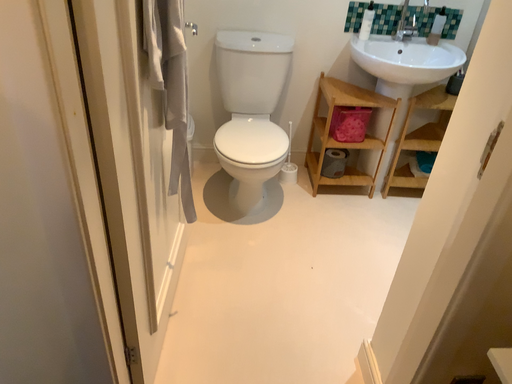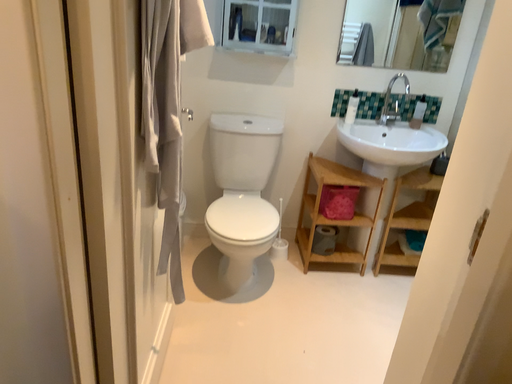
Question: Which way did the camera rotate in the video?

Choices:
 (A) rotated downward
 (B) rotated upward

Answer: (B)